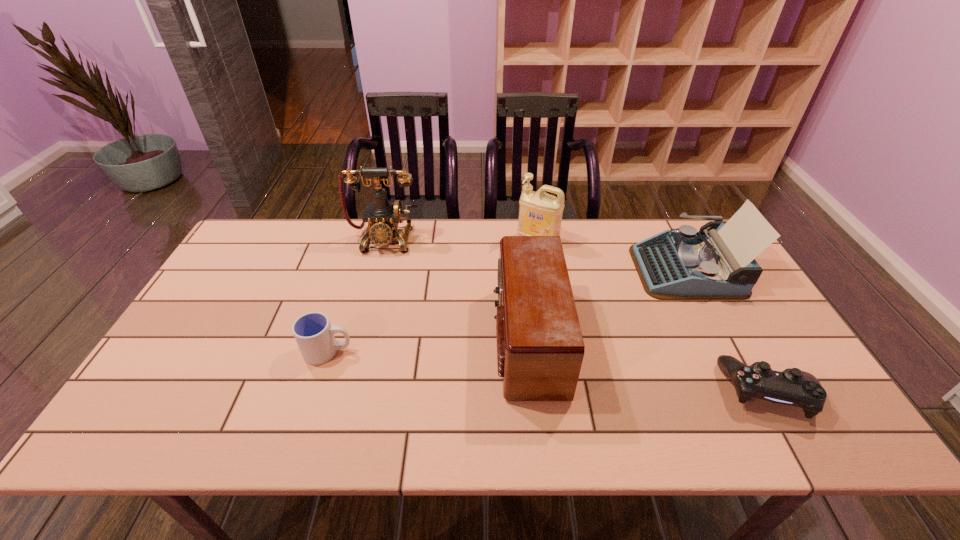
The height and width of the screenshot is (540, 960). I want to click on vacant region that satisfies the following two spatial constraints: 1. on the front of the telephone, featuring the rotary dial; 2. with the handle on the side of the cup, so click(x=355, y=352).

I want to click on free space that satisfies the following two spatial constraints: 1. with the handle on the side of the control; 2. on the left side of the cup, so click(x=315, y=392).

I want to click on free location that satisfies the following two spatial constraints: 1. on the front-facing side of the radio receiver; 2. on the back side of the control, so click(533, 392).

Identify the location of free space that satisfies the following two spatial constraints: 1. on the front side of the detergent; 2. on the right side of the control. (562, 392).